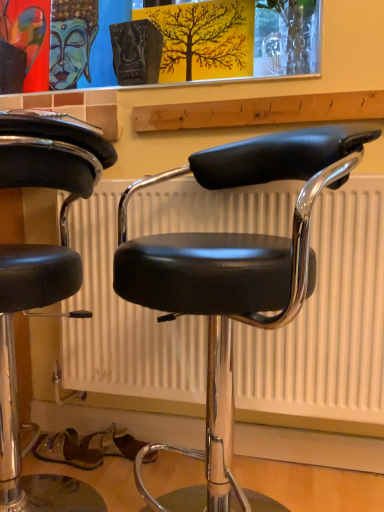
You are a GUI agent. You are given a task and a screenshot of the screen. Output one action in this format:
    pyautogui.click(x=<x>, y=<y>)
    Task: Click on the black leather stool at center, which ranks as the first chair in left-to-right order
    
    Given the screenshot: What is the action you would take?
    pyautogui.click(x=41, y=282)

In order to face black leather stool at center, which ranks as the first chair in left-to-right order, should I rotate leftwards or rightwards?

Rotate left and turn 23.379 degrees.

Measure the distance between point (x=2, y=428) and camera.

A distance of 1.07 meters exists between point (x=2, y=428) and camera.

This screenshot has width=384, height=512. What do you see at coordinates (41, 282) in the screenshot?
I see `black leather stool at center, which ranks as the first chair in left-to-right order` at bounding box center [41, 282].

Where is `black leather chair at center, the 1th chair positioned from the right`? The height and width of the screenshot is (512, 384). black leather chair at center, the 1th chair positioned from the right is located at coordinates (233, 280).

What do you see at coordinates (233, 280) in the screenshot? I see `black leather chair at center, the 1th chair positioned from the right` at bounding box center [233, 280].

You are a GUI agent. You are given a task and a screenshot of the screen. Output one action in this format:
    pyautogui.click(x=<x>, y=<y>)
    Task: Click on the black leather stool at center, the 2th chair in the right-to-left sequence
    The image size is (384, 512).
    Given the screenshot: What is the action you would take?
    pyautogui.click(x=41, y=282)

Visually, is black leather stool at center, the 2th chair in the right-to-left sequence, positioned to the left or to the right of black leather chair at center, which is the 2th chair from left to right?

Clearly, black leather stool at center, the 2th chair in the right-to-left sequence, is on the left of black leather chair at center, which is the 2th chair from left to right, in the image.

Is black leather stool at center, which ranks as the first chair in left-to-right order, in front of black leather chair at center, the 1th chair positioned from the right?

That is False.

Is point (63, 283) positioned before point (123, 234)?

Yes, point (63, 283) is in front of point (123, 234).

From the image's perspective, does black leather stool at center, the 2th chair in the right-to-left sequence, appear lower than black leather chair at center, which is the 2th chair from left to right?

Correct, black leather stool at center, the 2th chair in the right-to-left sequence, appears lower than black leather chair at center, which is the 2th chair from left to right, in the image.

From a real-world perspective, is black leather stool at center, which ranks as the first chair in left-to-right order, positioned under black leather chair at center, the 1th chair positioned from the right, based on gravity?

Yes, from a real-world perspective, black leather stool at center, which ranks as the first chair in left-to-right order, is beneath black leather chair at center, the 1th chair positioned from the right.

Which object is thinner, black leather stool at center, which ranks as the first chair in left-to-right order, or black leather chair at center, the 1th chair positioned from the right?

Thinner between the two is black leather stool at center, which ranks as the first chair in left-to-right order.

Considering the sizes of objects black leather stool at center, which ranks as the first chair in left-to-right order, and black leather chair at center, which is the 2th chair from left to right, in the image provided, who is taller, black leather stool at center, which ranks as the first chair in left-to-right order, or black leather chair at center, which is the 2th chair from left to right,?

Standing taller between the two is black leather chair at center, which is the 2th chair from left to right.

In the scene shown: Which of these two, black leather stool at center, the 2th chair in the right-to-left sequence, or black leather chair at center, the 1th chair positioned from the right, is smaller?

Smaller between the two is black leather stool at center, the 2th chair in the right-to-left sequence.

Is black leather stool at center, which ranks as the first chair in left-to-right order, positioned beyond the bounds of black leather chair at center, the 1th chair positioned from the right?

That's correct, black leather stool at center, which ranks as the first chair in left-to-right order, is outside of black leather chair at center, the 1th chair positioned from the right.

Are black leather stool at center, the 2th chair in the right-to-left sequence, and black leather chair at center, which is the 2th chair from left to right, far apart?

No, black leather stool at center, the 2th chair in the right-to-left sequence, is not far from black leather chair at center, which is the 2th chair from left to right.

Is black leather chair at center, the 1th chair positioned from the right, at the back of black leather stool at center, which ranks as the first chair in left-to-right order?

Yes, black leather stool at center, which ranks as the first chair in left-to-right order, is positioned with its back facing black leather chair at center, the 1th chair positioned from the right.

How many degrees apart are the facing directions of black leather stool at center, which ranks as the first chair in left-to-right order, and black leather chair at center, the 1th chair positioned from the right?

black leather stool at center, which ranks as the first chair in left-to-right order, and black leather chair at center, the 1th chair positioned from the right, are facing 0.000886 degrees away from each other.

Locate an element on the screen. The width and height of the screenshot is (384, 512). chair that is behind the black leather chair at center, which is the 2th chair from left to right is located at coordinates pyautogui.click(x=41, y=282).

Which is more to the left, black leather chair at center, the 1th chair positioned from the right, or black leather stool at center, which ranks as the first chair in left-to-right order?

black leather stool at center, which ranks as the first chair in left-to-right order.

Is the position of black leather chair at center, which is the 2th chair from left to right, more distant than that of black leather stool at center, the 2th chair in the right-to-left sequence?

That is False.

Which is behind, point (161, 270) or point (64, 485)?

The point (64, 485) is farther.

From the image's perspective, is black leather chair at center, the 1th chair positioned from the right, beneath black leather stool at center, which ranks as the first chair in left-to-right order?

Incorrect, from the image's perspective, black leather chair at center, the 1th chair positioned from the right, is higher than black leather stool at center, which ranks as the first chair in left-to-right order.

From a real-world perspective, is black leather chair at center, which is the 2th chair from left to right, under black leather stool at center, which ranks as the first chair in left-to-right order?

No, from a real-world perspective, black leather chair at center, which is the 2th chair from left to right, is not under black leather stool at center, which ranks as the first chair in left-to-right order.

Does black leather chair at center, which is the 2th chair from left to right, have a greater width compared to black leather stool at center, which ranks as the first chair in left-to-right order?

Yes, black leather chair at center, which is the 2th chair from left to right, is wider than black leather stool at center, which ranks as the first chair in left-to-right order.

Between black leather chair at center, the 1th chair positioned from the right, and black leather stool at center, which ranks as the first chair in left-to-right order, which one has more height?

black leather chair at center, the 1th chair positioned from the right.

Considering the sizes of black leather chair at center, which is the 2th chair from left to right, and black leather stool at center, the 2th chair in the right-to-left sequence, in the image, is black leather chair at center, which is the 2th chair from left to right, bigger or smaller than black leather stool at center, the 2th chair in the right-to-left sequence,?

Clearly, black leather chair at center, which is the 2th chair from left to right, is larger in size than black leather stool at center, the 2th chair in the right-to-left sequence.

Would you say black leather chair at center, which is the 2th chair from left to right, is outside black leather stool at center, which ranks as the first chair in left-to-right order?

That's correct, black leather chair at center, which is the 2th chair from left to right, is outside of black leather stool at center, which ranks as the first chair in left-to-right order.

Is black leather chair at center, the 1th chair positioned from the right, far away from black leather stool at center, the 2th chair in the right-to-left sequence?

They are positioned close to each other.

Is black leather chair at center, the 1th chair positioned from the right, oriented towards black leather stool at center, the 2th chair in the right-to-left sequence?

Yes, black leather chair at center, the 1th chair positioned from the right, is turned towards black leather stool at center, the 2th chair in the right-to-left sequence.

How different are the orientations of black leather chair at center, the 1th chair positioned from the right, and black leather stool at center, the 2th chair in the right-to-left sequence, in degrees?

They differ by 0.000886 degrees in their facing directions.

Locate an element on the screen. chair in front of the black leather stool at center, the 2th chair in the right-to-left sequence is located at coordinates (233, 280).

Image resolution: width=384 pixels, height=512 pixels. I want to click on chair to the left of black leather chair at center, the 1th chair positioned from the right, so click(x=41, y=282).

Image resolution: width=384 pixels, height=512 pixels. What are the coordinates of `chair that appears behind the black leather chair at center, the 1th chair positioned from the right` in the screenshot? It's located at (41, 282).